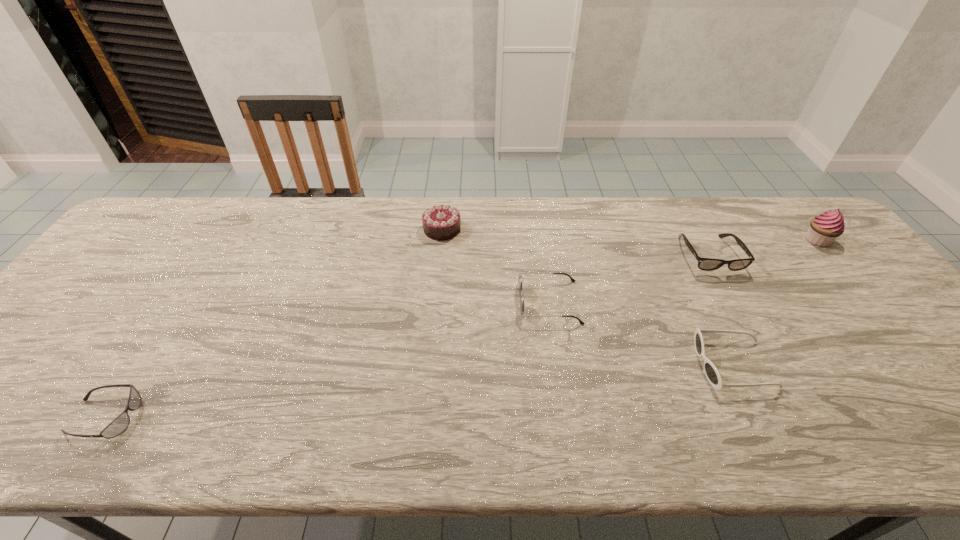
This screenshot has width=960, height=540. What are the coordinates of `vacant space at the far right corner` in the screenshot? It's located at (775, 228).

Locate an element on the screen. free space between the second object from left to right and the spectacles is located at coordinates (576, 242).

Where is `vacant space in between the cupcake and the chocolate cake`? Image resolution: width=960 pixels, height=540 pixels. vacant space in between the cupcake and the chocolate cake is located at coordinates (630, 235).

Where is `vacant space that's between the spectacles and the leftmost object`? vacant space that's between the spectacles and the leftmost object is located at coordinates (407, 336).

Where is `vacant region between the leftmost sunglasses and the fourth farthest object`? vacant region between the leftmost sunglasses and the fourth farthest object is located at coordinates (327, 360).

I want to click on free spot between the fifth shortest object and the rightmost object, so click(630, 235).

Where is `free space between the rightmost sunglasses and the spectacles`? free space between the rightmost sunglasses and the spectacles is located at coordinates (721, 310).

At what (x,y) coordinates should I click in order to perform the action: click on free spot between the second object from left to right and the third nearest object. Please return your answer as a coordinate pair (x, y). Looking at the image, I should click on (x=495, y=266).

Identify the location of free space between the tallest object and the shortest sunglasses. This screenshot has width=960, height=540. (461, 329).

This screenshot has width=960, height=540. I want to click on free space between the shortest sunglasses and the cupcake, so click(x=461, y=329).